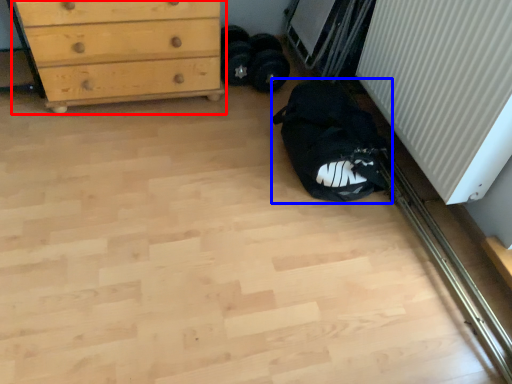
Question: Which point is further to the camera, chest of drawers (highlighted by a red box) or sleeping bag (highlighted by a blue box)?

Choices:
 (A) chest of drawers
 (B) sleeping bag

Answer: (A)